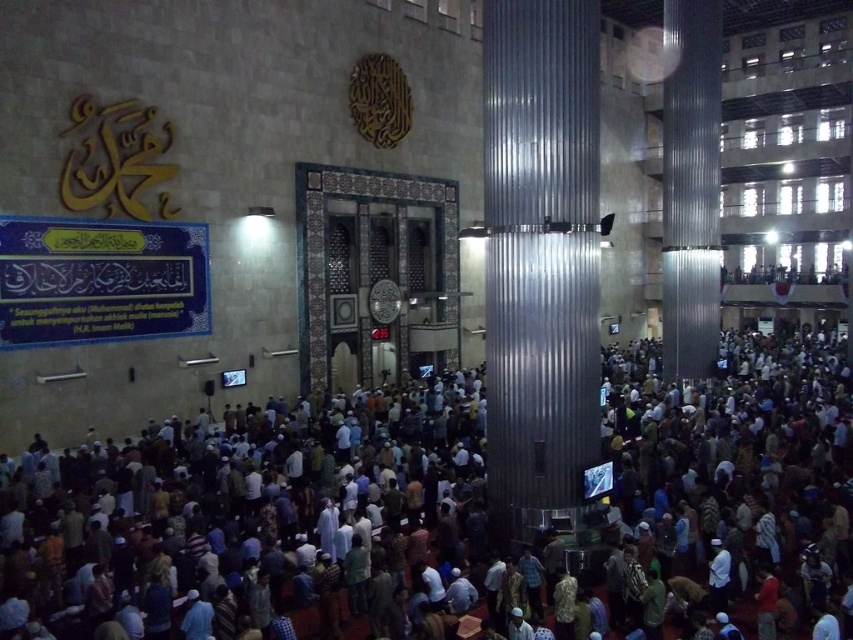
You are a photographer standing at the entrance of the mosque. You want to take a photo that includes both the dark brown fabric crowd at center and the metallic corrugated pillar at center. Given that your camera has a maximum focus range of 10 meters, will you be able to capture both subjects in focus without moving your position?

The dark brown fabric crowd at center and the metallic corrugated pillar at center are 12.63 meters apart. Since the distance between them exceeds the camera maximum focus range of 10 meters, you cannot capture both subjects in focus without moving your position.

You are standing in the mosque and want to take a photo of both the entrance and the banner on the left wall. Which point, point [578,237] or point [683,29], should you focus on first to ensure both are in clear view?

You should focus on point [578,237] first because it is closer to the camera than point [683,29], ensuring both are in clear view.